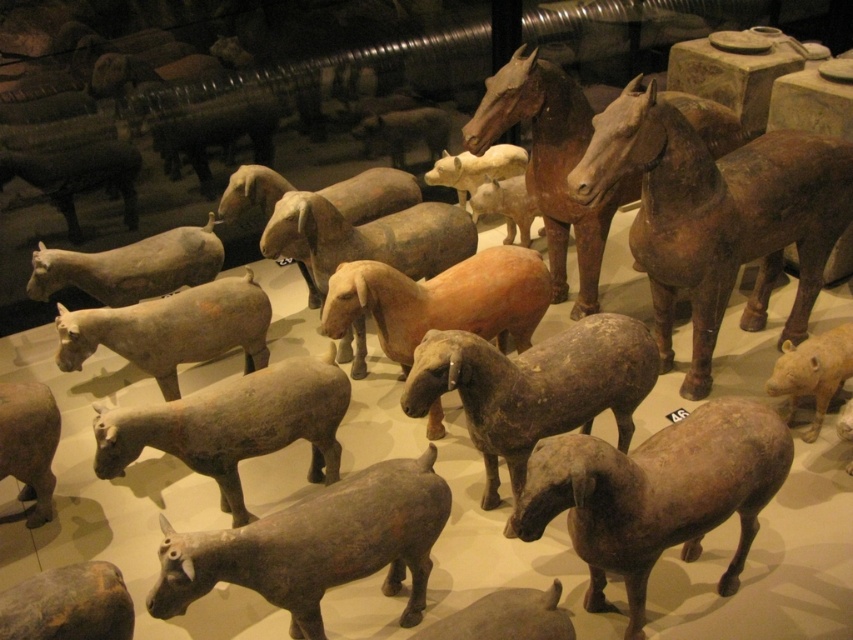
You are a museum curator arranging an exhibition. You need to place a new sign that will be visible from the main entrance. The sign must be placed in front of both the brown matte horse at center and the matte gray sheep at lower left. Is this possible given their current positions?

The matte gray sheep at lower left is behind the brown matte horse at center, so placing a sign in front of both would not be possible as the sheep is already positioned behind the horse.

You are a museum curator arranging the ancient terracotta animal figurines. You notice two sheep figurines at the center of the display. One is labeled as matte gray sheep at center and the other as earthenware sheep at center. Which of these two sheep figurines is located to the right when viewed from the front of the display?

The matte gray sheep at center is positioned on the right side of the earthenware sheep at center, so when viewed from the front of the display, the matte gray sheep at center is to the right of the earthenware sheep at center.